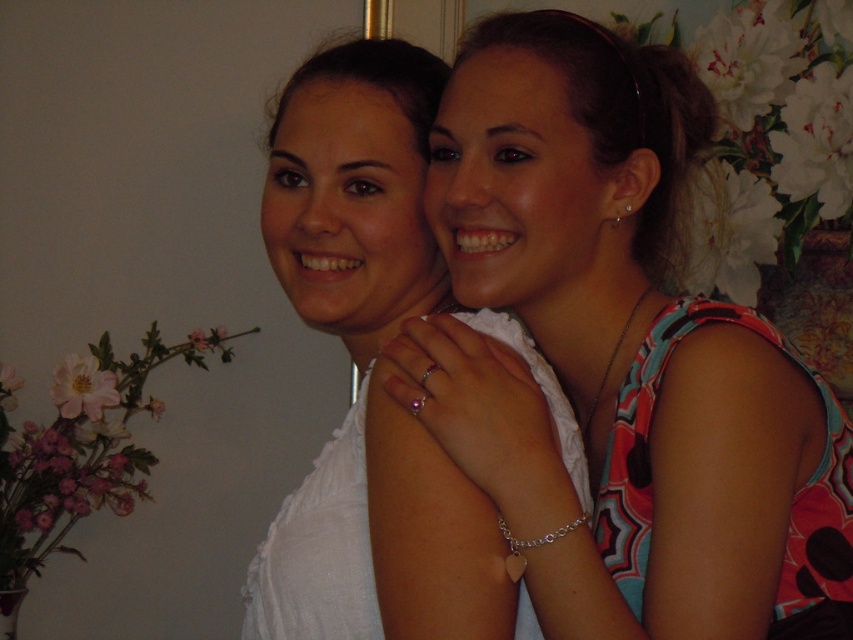
Question: Which object is closer to the camera taking this photo?

Choices:
 (A) white fabric dress at center
 (B) multicolored fabric dress at center

Answer: (B)

Question: Is multicolored fabric dress at center further to the viewer compared to white fabric dress at center?

Choices:
 (A) no
 (B) yes

Answer: (A)

Question: Is multicolored fabric dress at center positioned behind white fabric dress at center?

Choices:
 (A) no
 (B) yes

Answer: (A)

Question: Which object is closer to the camera taking this photo?

Choices:
 (A) multicolored fabric dress at center
 (B) white fabric dress at center

Answer: (A)

Question: Is multicolored fabric dress at center above white fabric dress at center?

Choices:
 (A) yes
 (B) no

Answer: (A)

Question: Which point is farther to the camera?

Choices:
 (A) multicolored fabric dress at center
 (B) white fabric dress at center

Answer: (B)